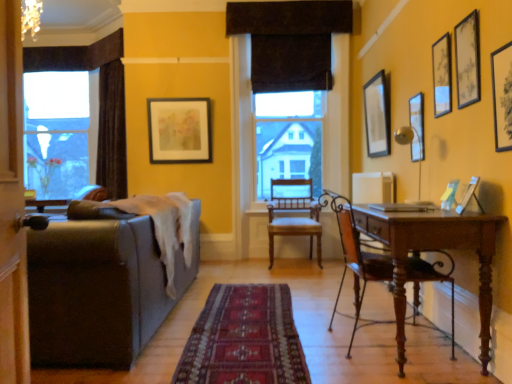
Where is `free space below matte white picture frame at right, arranged as the second picture frame when viewed from the left (from a real-world perspective)`? free space below matte white picture frame at right, arranged as the second picture frame when viewed from the left (from a real-world perspective) is located at coordinates (468, 211).